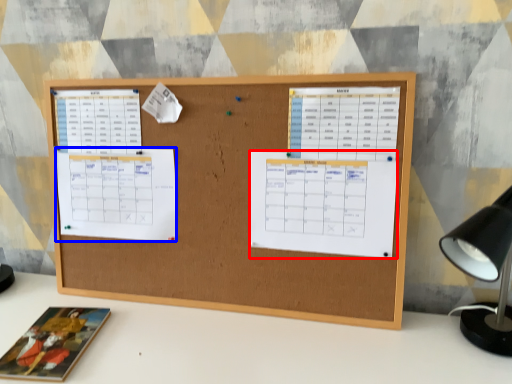
Question: Which object is further to the camera taking this photo, list (highlighted by a red box) or list (highlighted by a blue box)?

Choices:
 (A) list
 (B) list

Answer: (B)